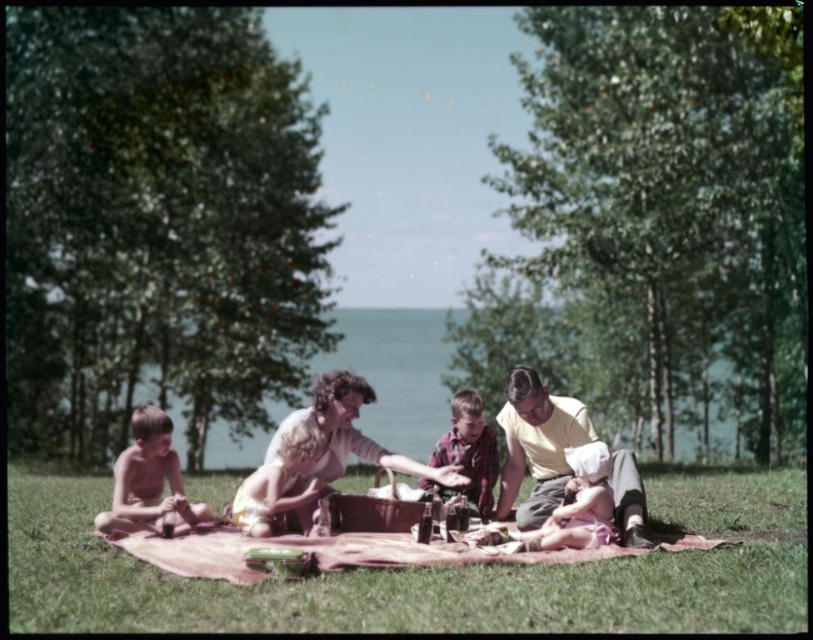
Question: Can you confirm if yellow cotton shirt at center is positioned to the right of plaid fabric shirt at center?

Choices:
 (A) yes
 (B) no

Answer: (A)

Question: Considering the real-world distances, which object is closest to the green grass at lower center?

Choices:
 (A) matte pink blanket at center
 (B) blond hair boy at lower left
 (C) green water at center

Answer: (A)

Question: Is green grass at lower center further to camera compared to yellow cotton shirt at center?

Choices:
 (A) no
 (B) yes

Answer: (A)

Question: Which object is the closest to the matte yellow shirt at center?

Choices:
 (A) matte pink blanket at center
 (B) blond hair boy at lower left

Answer: (A)

Question: Estimate the real-world distances between objects in this image. Which object is closer to the plaid fabric shirt at center?

Choices:
 (A) yellow cotton shirt at center
 (B) matte pink blanket at center
 (C) light brown fabric diaper at center

Answer: (A)

Question: From the image, what is the correct spatial relationship of green water at center in relation to matte yellow shirt at center?

Choices:
 (A) left
 (B) right

Answer: (B)